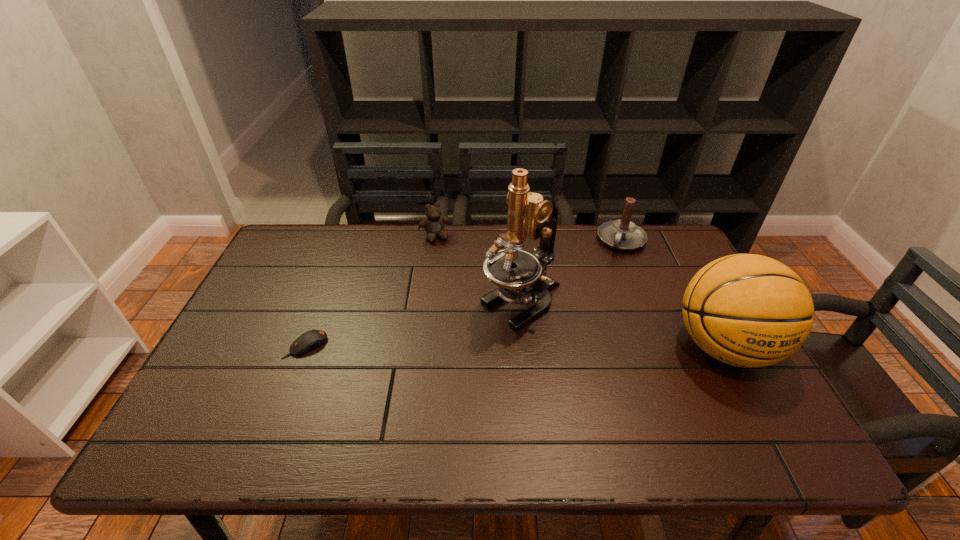
You are a GUI agent. You are given a task and a screenshot of the screen. Output one action in this format:
    pyautogui.click(x=<x>, y=<y>)
    Task: Click on the blank area located 0.110m on the face of the fourth tallest object
    The image size is (960, 540).
    Given the screenshot: What is the action you would take?
    pyautogui.click(x=448, y=264)

Where is `free location located on the face of the fourth tallest object`? free location located on the face of the fourth tallest object is located at coordinates (446, 260).

Identify the location of vacant space located on the side of the third tallest object with the handle loop. The height and width of the screenshot is (540, 960). click(611, 265).

The image size is (960, 540). Find the location of `free space located 0.320m on the side of the third tallest object with the handle loop`. free space located 0.320m on the side of the third tallest object with the handle loop is located at coordinates (586, 319).

Where is `free space located on the side of the third tallest object with the handle loop`? This screenshot has height=540, width=960. free space located on the side of the third tallest object with the handle loop is located at coordinates (576, 339).

Where is `free space located 0.160m at the eyepiece of the microscope`? free space located 0.160m at the eyepiece of the microscope is located at coordinates (443, 353).

Identify the location of vacant space located at the eyepiece of the microscope. The height and width of the screenshot is (540, 960). pyautogui.click(x=452, y=347).

Locate an element on the screen. Image resolution: width=960 pixels, height=540 pixels. vacant space located at the eyepiece of the microscope is located at coordinates (459, 342).

In order to click on teddy bear that is positioned at the far edge in this screenshot , I will do `click(434, 223)`.

At what (x,y) coordinates should I click in order to perform the action: click on candle present at the far edge. Please return your answer as a coordinate pair (x, y). Image resolution: width=960 pixels, height=540 pixels. Looking at the image, I should click on (622, 234).